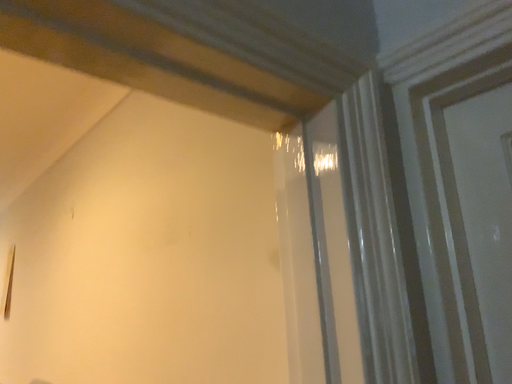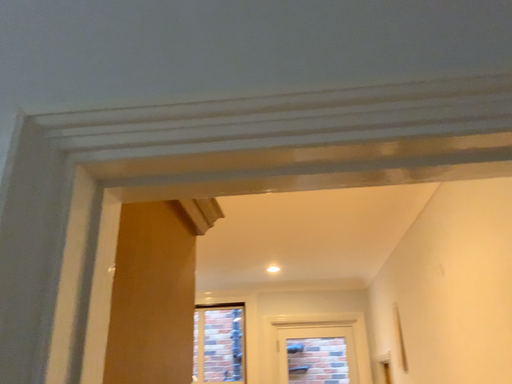
Question: How did the camera likely rotate when shooting the video?

Choices:
 (A) rotated left
 (B) rotated right

Answer: (A)